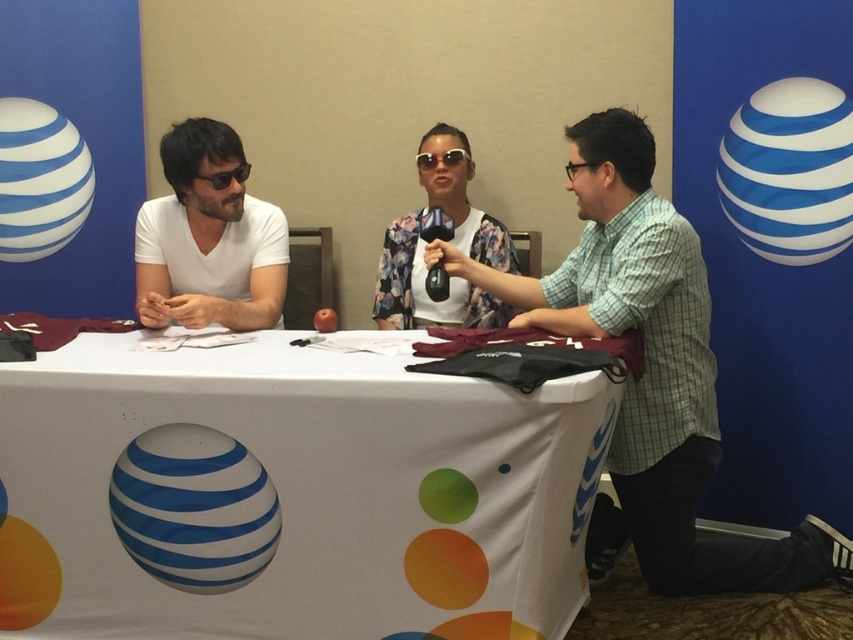
You are organizing a promotional event and need to place a 1.5 meter wide banner on the table. Given the white fabric table at center and the checkered fabric shirt at center, which object can accommodate the banner based on their sizes?

The white fabric table at center can accommodate the banner since its width is larger than the checkered fabric shirt at center.

Looking at this image, you are organizing a promotional event and need to place a large banner on the table. Given that the banner is larger than the matte black sunglasses at left, will it fit on the white fabric table at center?

The white fabric table at center is bigger than the matte black sunglasses at left, so the banner, being larger than the sunglasses, may still fit on the table if its size does not exceed the table dimensions. However, the exact fit depends on the banner size relative to the table, which isn not specified.

You are a photographer at the event and need to position a light source to the right of the white fabric table at center and above the matte black sunglasses at left. Is this possible given their positions?

The white fabric table at center is located below the matte black sunglasses at left, so positioning a light source to the right of the white fabric table at center and above the matte black sunglasses at left is possible since the table is below the sunglasses, allowing space above the sunglasses for the light.